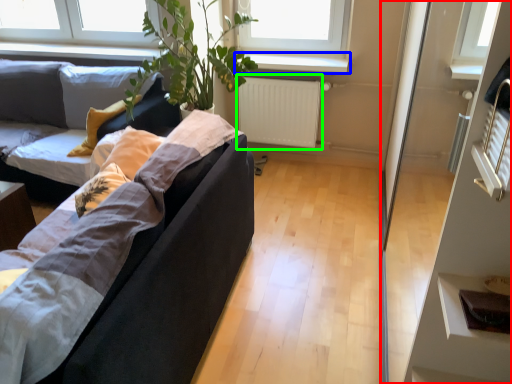
Question: Considering the real-world distances, which object is closest to glass door (highlighted by a red box)? window sill (highlighted by a blue box) or radiator (highlighted by a green box).

Choices:
 (A) window sill
 (B) radiator

Answer: (A)